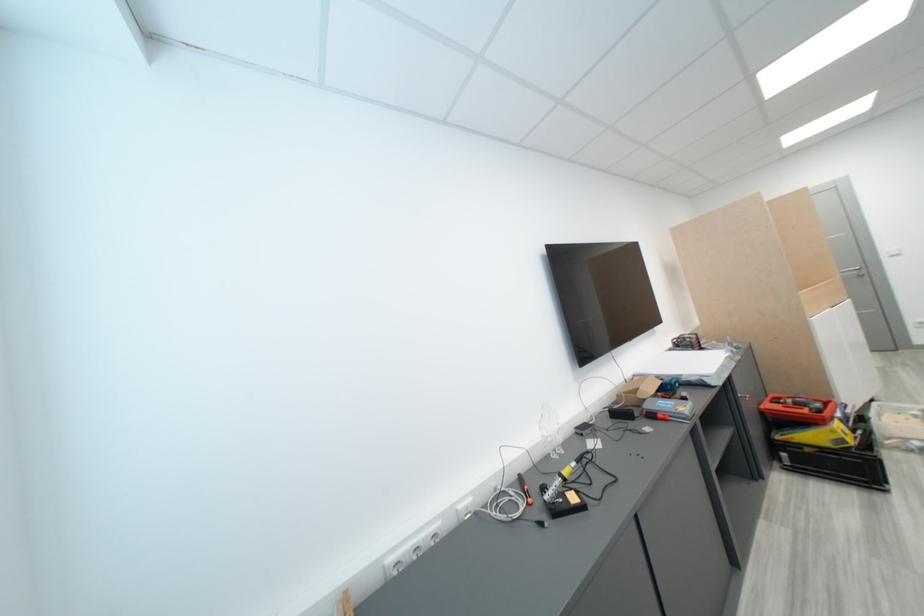
Image resolution: width=924 pixels, height=616 pixels. Find the location of `orange toolbox handle`. orange toolbox handle is located at coordinates (797, 408).